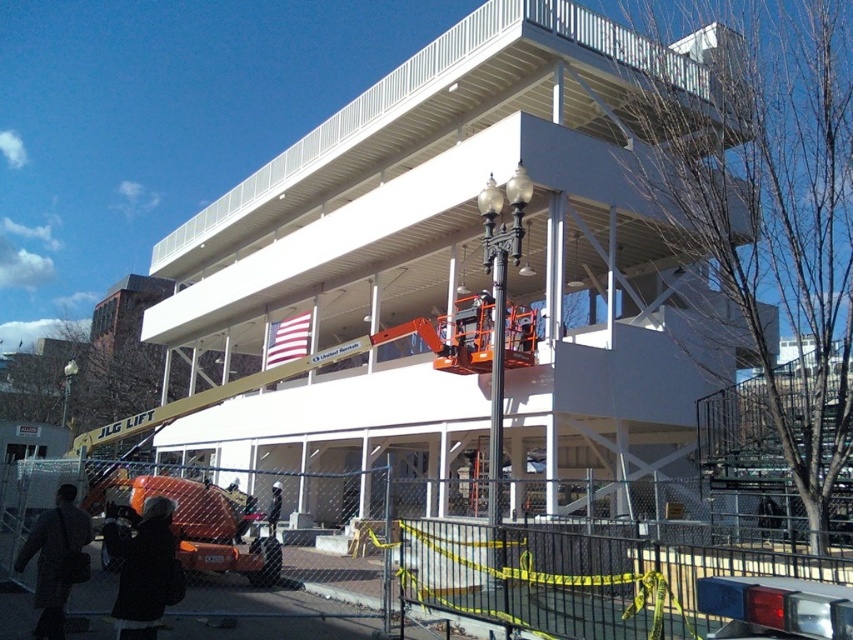
Who is taller, black wool coat at lower left or dark gray coat at lower left?

dark gray coat at lower left

Is black wool coat at lower left wider than dark gray coat at lower left?

Correct, the width of black wool coat at lower left exceeds that of dark gray coat at lower left.

Between point (165, 525) and point (33, 524), which one is positioned in front?

Positioned in front is point (165, 525).

Identify the location of black wool coat at lower left. (143, 566).

Does dark gray coat at lower left have a lesser height compared to black fabric jacket at center?

No, dark gray coat at lower left is not shorter than black fabric jacket at center.

Does dark gray coat at lower left have a greater width compared to black fabric jacket at center?

Correct, the width of dark gray coat at lower left exceeds that of black fabric jacket at center.

Image resolution: width=853 pixels, height=640 pixels. Describe the element at coordinates (56, 560) in the screenshot. I see `dark gray coat at lower left` at that location.

Where is `dark gray coat at lower left`? This screenshot has width=853, height=640. dark gray coat at lower left is located at coordinates (x=56, y=560).

Is black wool coat at lower left smaller than black fabric jacket at center?

Incorrect, black wool coat at lower left is not smaller in size than black fabric jacket at center.

Who is taller, black wool coat at lower left or black fabric jacket at center?

Standing taller between the two is black wool coat at lower left.

Who is more distant from viewer, (x=152, y=632) or (x=277, y=497)?

Point (x=277, y=497)

You are a GUI agent. You are given a task and a screenshot of the screen. Output one action in this format:
    pyautogui.click(x=<x>, y=<y>)
    Task: Click on the black wool coat at lower left
    This screenshot has width=853, height=640.
    Given the screenshot: What is the action you would take?
    pyautogui.click(x=143, y=566)